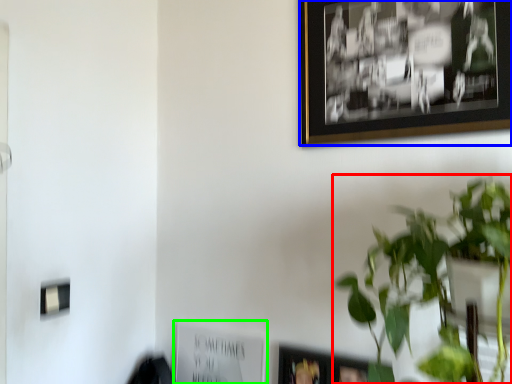
Question: Which object is the farthest from houseplant (highlighted by a red box)? Choose among these: picture frame (highlighted by a blue box) or picture frame (highlighted by a green box).

Choices:
 (A) picture frame
 (B) picture frame

Answer: (B)